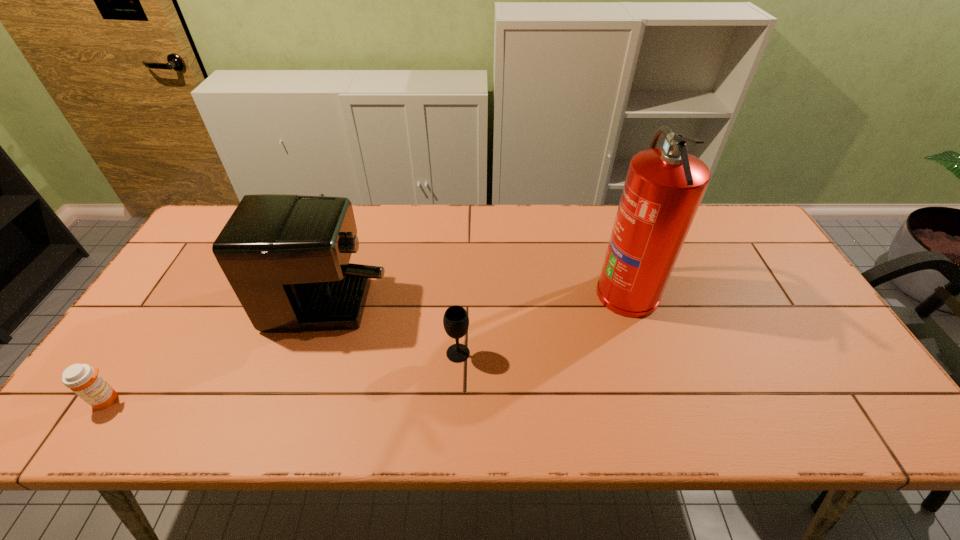
Identify the location of vacant space situated 0.210m on the instruction side of the rightmost object. (521, 291).

The width and height of the screenshot is (960, 540). What are the coordinates of `free space located on the front-facing side of the third shortest object` in the screenshot? It's located at (460, 264).

Where is `vacant region located on the back of the wineglass`? The width and height of the screenshot is (960, 540). vacant region located on the back of the wineglass is located at coordinates (463, 251).

Find the location of a particular element. Image resolution: width=960 pixels, height=540 pixels. vacant space located on the back of the medicine is located at coordinates (144, 344).

Image resolution: width=960 pixels, height=540 pixels. Identify the location of object at the far edge. (286, 257).

The width and height of the screenshot is (960, 540). In order to click on object located in the near edge section of the desktop in this screenshot , I will do `click(84, 380)`.

Where is `object positioned at the left edge`? This screenshot has height=540, width=960. object positioned at the left edge is located at coordinates click(x=84, y=380).

Where is `object that is at the near left corner`? The width and height of the screenshot is (960, 540). object that is at the near left corner is located at coordinates (84, 380).

Where is `free location at the far edge`? The height and width of the screenshot is (540, 960). free location at the far edge is located at coordinates (392, 230).

Find the location of a particular element. The height and width of the screenshot is (540, 960). free space at the near edge of the desktop is located at coordinates (803, 435).